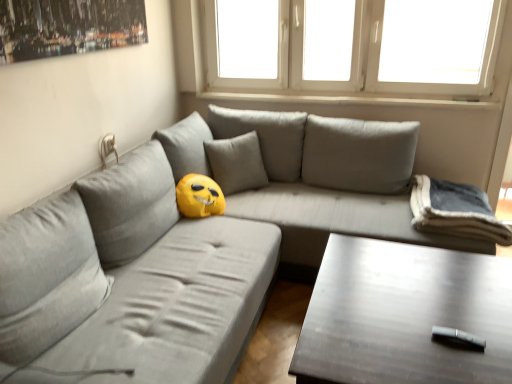
Question: From the image's perspective, is yellow plush at center, positioned as the second pillow in right-to-left order, located above gray fabric couch at center?

Choices:
 (A) yes
 (B) no

Answer: (A)

Question: Does yellow plush at center, which is the first pillow in left-to-right order, have a larger size compared to gray fabric couch at center?

Choices:
 (A) no
 (B) yes

Answer: (A)

Question: Is yellow plush at center, which is the first pillow in left-to-right order, outside of gray fabric couch at center?

Choices:
 (A) yes
 (B) no

Answer: (B)

Question: From a real-world perspective, is yellow plush at center, which is the first pillow in left-to-right order, on top of gray fabric couch at center?

Choices:
 (A) yes
 (B) no

Answer: (A)

Question: From the image's perspective, is yellow plush at center, positioned as the second pillow in right-to-left order, beneath gray fabric couch at center?

Choices:
 (A) yes
 (B) no

Answer: (B)

Question: Is yellow plush at center, which is the first pillow in left-to-right order, wider than gray fabric couch at center?

Choices:
 (A) no
 (B) yes

Answer: (A)

Question: Can you see dark wood table at lower right touching white plastic window at upper center?

Choices:
 (A) no
 (B) yes

Answer: (A)

Question: Are dark wood table at lower right and white plastic window at upper center far apart?

Choices:
 (A) yes
 (B) no

Answer: (A)

Question: Is white plastic window at upper center at the back of dark wood table at lower right?

Choices:
 (A) no
 (B) yes

Answer: (A)

Question: From the image's perspective, is dark wood table at lower right beneath white plastic window at upper center?

Choices:
 (A) yes
 (B) no

Answer: (A)

Question: Is dark wood table at lower right wider than white plastic window at upper center?

Choices:
 (A) no
 (B) yes

Answer: (B)

Question: Is dark wood table at lower right behind white plastic window at upper center?

Choices:
 (A) yes
 (B) no

Answer: (B)

Question: Is gray fabric couch at center positioned far away from gray fleece blanket at right, the 1th pillow in the right-to-left sequence?

Choices:
 (A) yes
 (B) no

Answer: (B)